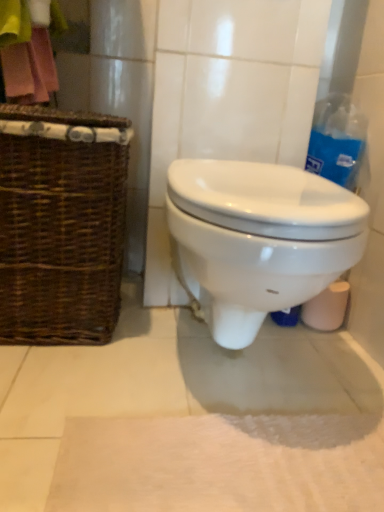
Question: From the image's perspective, is brown woven picnic basket at left located above white glossy toilet at center?

Choices:
 (A) no
 (B) yes

Answer: (B)

Question: From the image's perspective, is brown woven picnic basket at left below white glossy toilet at center?

Choices:
 (A) no
 (B) yes

Answer: (A)

Question: Is brown woven picnic basket at left looking in the opposite direction of white glossy toilet at center?

Choices:
 (A) yes
 (B) no

Answer: (B)

Question: From a real-world perspective, is brown woven picnic basket at left on white glossy toilet at center?

Choices:
 (A) yes
 (B) no

Answer: (A)

Question: From a real-world perspective, is brown woven picnic basket at left under white glossy toilet at center?

Choices:
 (A) yes
 (B) no

Answer: (B)

Question: Is there a large distance between brown woven picnic basket at left and white glossy toilet at center?

Choices:
 (A) no
 (B) yes

Answer: (A)

Question: Can you confirm if pink fabric at upper left is shorter than white soft bath mat at lower center?

Choices:
 (A) no
 (B) yes

Answer: (A)

Question: Is pink fabric at upper left to the left of white soft bath mat at lower center from the viewer's perspective?

Choices:
 (A) no
 (B) yes

Answer: (B)

Question: Does pink fabric at upper left have a larger size compared to white soft bath mat at lower center?

Choices:
 (A) yes
 (B) no

Answer: (B)

Question: Is the position of pink fabric at upper left more distant than that of white soft bath mat at lower center?

Choices:
 (A) yes
 (B) no

Answer: (A)

Question: Is pink fabric at upper left surrounding white soft bath mat at lower center?

Choices:
 (A) yes
 (B) no

Answer: (B)

Question: Is pink fabric at upper left positioned beyond the bounds of white soft bath mat at lower center?

Choices:
 (A) no
 (B) yes

Answer: (B)

Question: From a real-world perspective, does brown woven picnic basket at left sit lower than white soft bath mat at lower center?

Choices:
 (A) no
 (B) yes

Answer: (A)